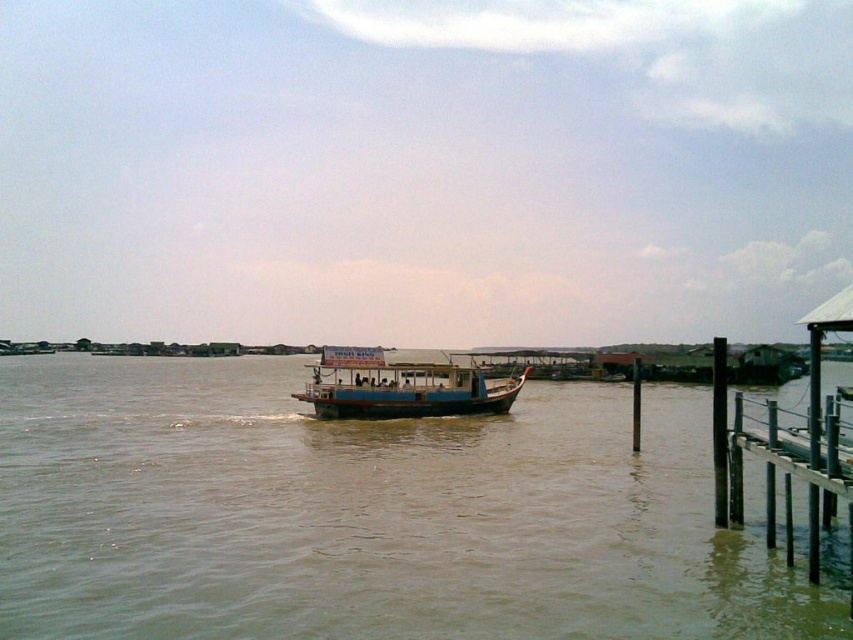
Is black metal dock at lower right bigger than blue wooden boat at center?

Yes, black metal dock at lower right is bigger than blue wooden boat at center.

Is point (834, 509) closer to viewer compared to point (445, 368)?

Yes, point (834, 509) is closer to viewer.

Where is `black metal dock at lower right`? black metal dock at lower right is located at coordinates (785, 461).

Can you confirm if brown muddy water at center is wider than black metal dock at lower right?

Indeed, brown muddy water at center has a greater width compared to black metal dock at lower right.

Is point (555, 499) farther from viewer compared to point (827, 522)?

Yes.

Is point (631, 531) less distant than point (825, 410)?

That is False.

Locate an element on the screen. This screenshot has height=640, width=853. brown muddy water at center is located at coordinates click(375, 515).

Who is positioned more to the left, brown muddy water at center or blue wooden boat at center?

brown muddy water at center is more to the left.

Does brown muddy water at center lie in front of blue wooden boat at center?

Yes, brown muddy water at center is closer to the viewer.

Between point (262, 518) and point (366, 369), which one is positioned behind?

The point (366, 369) is more distant.

Find the location of a particular element. brown muddy water at center is located at coordinates (375, 515).